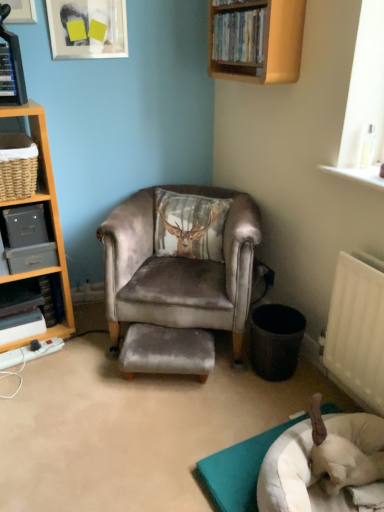
Where is `free space in front of velvet grey stool at center`? The image size is (384, 512). free space in front of velvet grey stool at center is located at coordinates (170, 417).